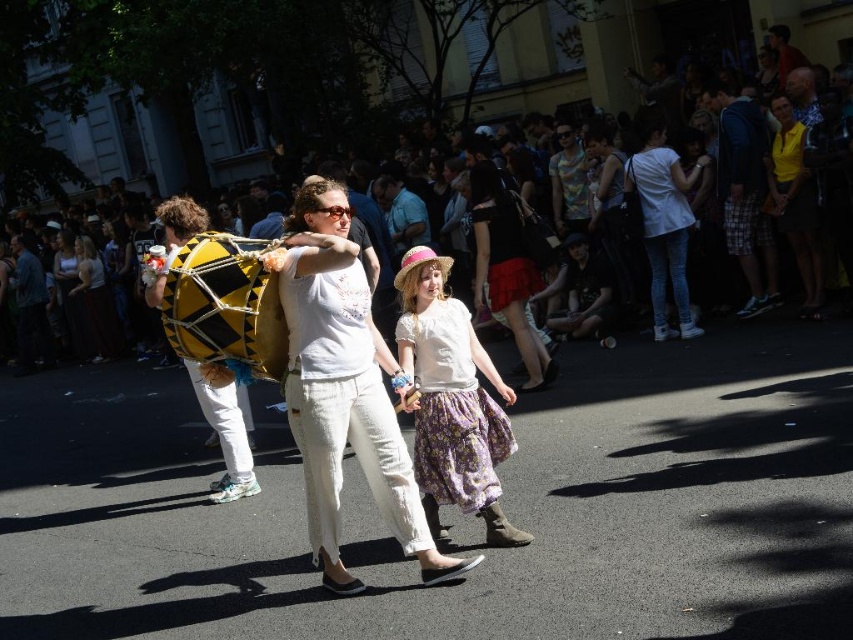
Between yellow and black drum at left and reddish-brown leather jacket at upper right, which one is positioned lower?

yellow and black drum at left is below.

Is yellow and black drum at left to the right of reddish-brown leather jacket at upper right from the viewer's perspective?

→ In fact, yellow and black drum at left is to the left of reddish-brown leather jacket at upper right.

Is point (167, 228) farther from camera compared to point (775, 36)?

No, it is not.

The width and height of the screenshot is (853, 640). Identify the location of yellow and black drum at left. (224, 429).

Which is behind, point (248, 90) or point (392, 195)?

The point (248, 90) is more distant.

Can you confirm if matte yellow drum at center is wider than matte blue shirt at center?

Indeed, matte yellow drum at center has a greater width compared to matte blue shirt at center.

Between point (524, 58) and point (399, 182), which one is positioned in front?

Point (399, 182) is more forward.

The height and width of the screenshot is (640, 853). Identify the location of matte yellow drum at center. (556, 77).

What do you see at coordinates (30, 307) in the screenshot?
I see `denim jacket at left` at bounding box center [30, 307].

Can you confirm if denim jacket at left is smaller than reddish-brown leather jacket at upper right?

No.

Is point (28, 356) more distant than point (804, 54)?

Yes, it is.

The image size is (853, 640). In order to click on denim jacket at left in this screenshot , I will do `click(30, 307)`.